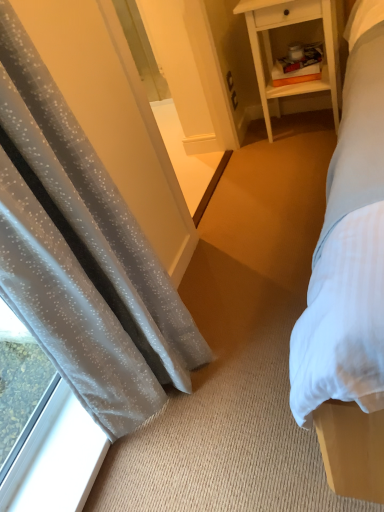
Question: In the image, is white wood nightstand at upper right on the left side or the right side of translucent gray curtain at left?

Choices:
 (A) right
 (B) left

Answer: (A)

Question: From a real-world perspective, is white wood nightstand at upper right positioned above or below translucent gray curtain at left?

Choices:
 (A) above
 (B) below

Answer: (B)

Question: Which is farther from the transparent glass window at lower left?

Choices:
 (A) white wood nightstand at upper right
 (B) translucent gray curtain at left

Answer: (A)

Question: Based on their relative distances, which object is farther from the transparent glass window at lower left?

Choices:
 (A) white wood nightstand at upper right
 (B) translucent gray curtain at left

Answer: (A)